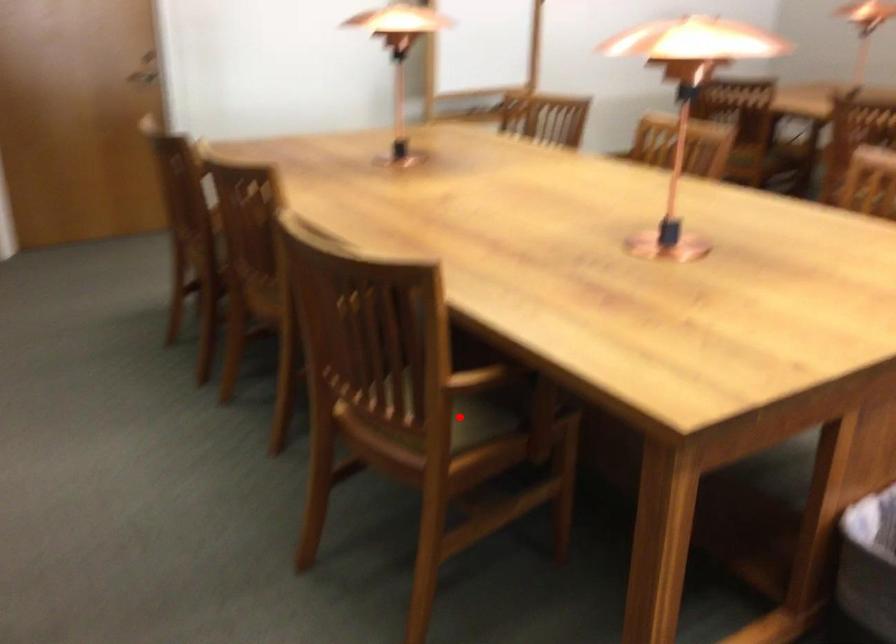
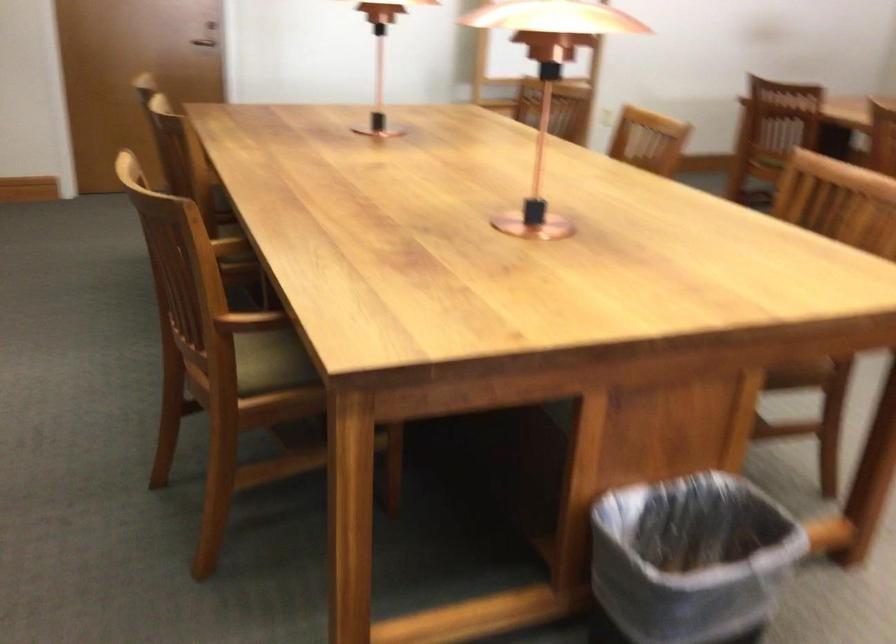
Question: I am providing you with two images of the same scene from different viewpoints. A red point is marked on the first image. Can you still see the location of the red point in image 2?

Choices:
 (A) Yes
 (B) No

Answer: (A)